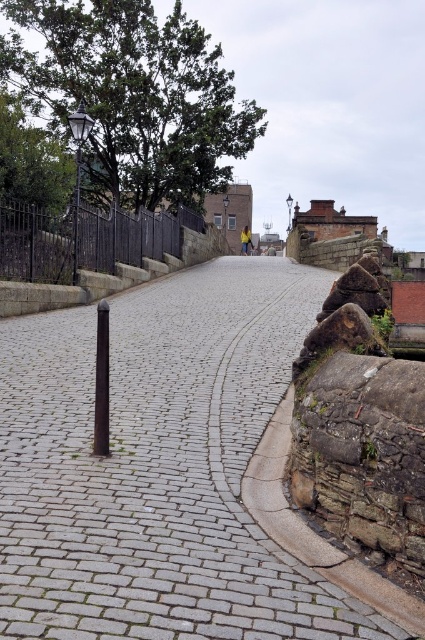
Is point (138, 156) farther from camera compared to point (96, 342)?

Yes, point (138, 156) is behind point (96, 342).

Between green leafy tree at upper left and black polished pole at center, which one has more height?

Standing taller between the two is green leafy tree at upper left.

Between point (68, 22) and point (102, 321), which one is positioned in front?

Point (102, 321)

The width and height of the screenshot is (425, 640). I want to click on green leafy tree at upper left, so click(x=133, y=93).

Does gray cobblestone pavement at center lie behind black polished pole at center?

No, it is not.

Does gray cobblestone pavement at center appear on the left side of black polished pole at center?

No, gray cobblestone pavement at center is not to the left of black polished pole at center.

Where is `gray cobblestone pavement at center`? gray cobblestone pavement at center is located at coordinates (158, 467).

Which of these two, black wrought iron fence at upper left or black polished pole at center, stands taller?

With more height is black wrought iron fence at upper left.

Is point (84, 253) positioned in front of point (98, 316)?

No, it is behind (98, 316).

Locate an element on the screen. black wrought iron fence at upper left is located at coordinates (85, 240).